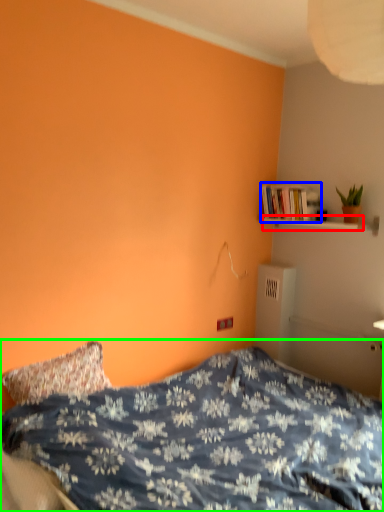
Question: Which object is positioned farthest from shelf (highlighted by a red box)? Select from book (highlighted by a blue box) and bed (highlighted by a green box).

Choices:
 (A) book
 (B) bed

Answer: (B)